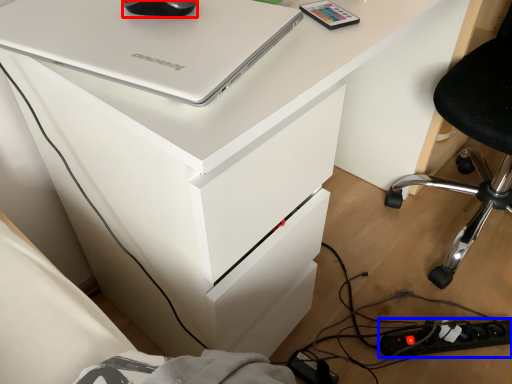
Question: Which point is further to the camera, mouse (highlighted by a red box) or extension cord (highlighted by a blue box)?

Choices:
 (A) mouse
 (B) extension cord

Answer: (B)